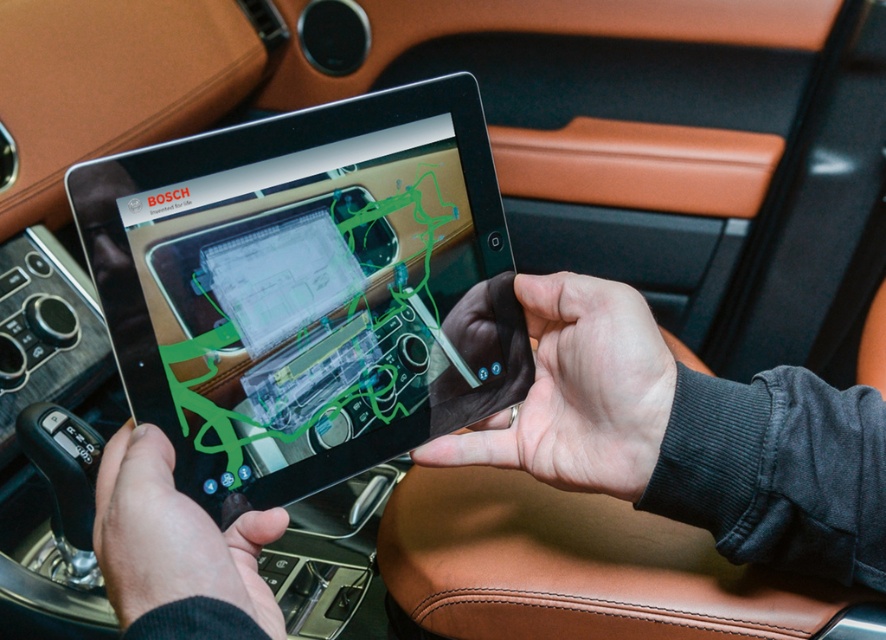
You are a mechanic trying to view a technical diagram on the black glossy tablet at center while holding it with your smooth leather hand at center. Can you comfortably hold the tablet with both hands without the diagram being obstructed?

The black glossy tablet at center is taller than the smooth leather hand at center, so yes, you can comfortably hold the tablet with both hands without the diagram being obstructed because the tablet is taller than the hand, allowing enough space to grip it securely.

You are a technician trying to inspect the tablet screen and your hand holding it. Which object is closer to you, the black glossy tablet at center or the black matte hand at lower left?

The black glossy tablet at center is closer to you than the black matte hand at lower left.